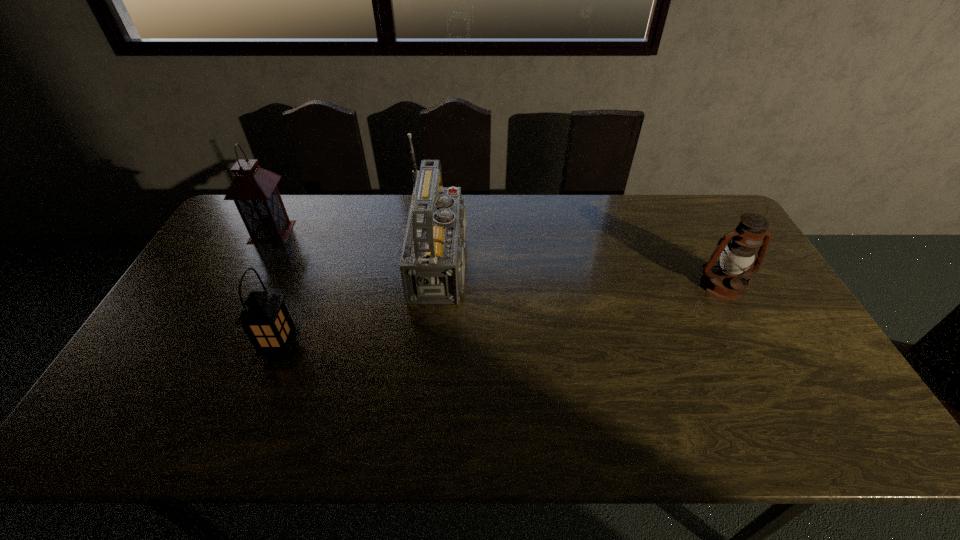
Where is `the third object from left to right`? the third object from left to right is located at coordinates (x=432, y=265).

Identify the location of the leftmost object. The image size is (960, 540). (254, 190).

You are a GUI agent. You are given a task and a screenshot of the screen. Output one action in this format:
    pyautogui.click(x=<x>, y=<y>)
    Task: Click on the leftmost lantern
    The width and height of the screenshot is (960, 540).
    Given the screenshot: What is the action you would take?
    pyautogui.click(x=254, y=190)

This screenshot has width=960, height=540. What are the coordinates of `the rightmost object` in the screenshot? It's located at (727, 281).

Where is `the second farthest lantern`? The width and height of the screenshot is (960, 540). the second farthest lantern is located at coordinates (727, 281).

This screenshot has width=960, height=540. Find the location of `the third object from right to left`. the third object from right to left is located at coordinates (265, 319).

Find the location of a particular element. Image resolution: width=960 pixels, height=540 pixels. the second lantern from right to left is located at coordinates [x=265, y=319].

Where is `vacant region located 0.160m on the front-facing side of the radio receiver`? This screenshot has height=540, width=960. vacant region located 0.160m on the front-facing side of the radio receiver is located at coordinates (536, 263).

This screenshot has width=960, height=540. I want to click on vacant area situated 0.140m on the right of the farthest lantern, so click(333, 232).

You are a GUI agent. You are given a task and a screenshot of the screen. Output one action in this format:
    pyautogui.click(x=<x>, y=<y>)
    Task: Click on the free region located on the side of the rightmost object, there is a wick adjustment knob
    Image resolution: width=960 pixels, height=540 pixels.
    Given the screenshot: What is the action you would take?
    pyautogui.click(x=748, y=332)